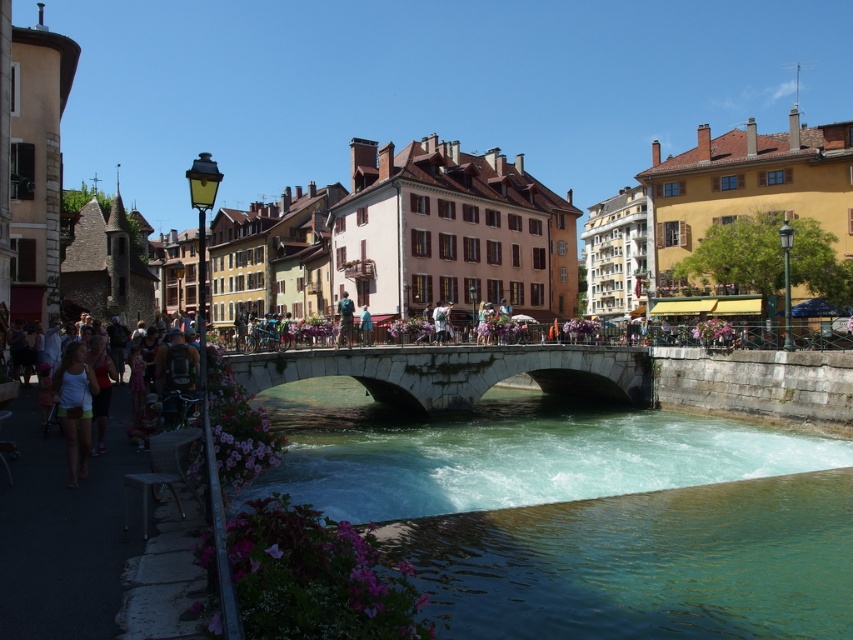
Question: Which object appears closest to the camera in this image?

Choices:
 (A) clear stone water at center
 (B) white cotton shirt at lower left
 (C) smooth stone bridge at center
 (D) blue denim jeans at center

Answer: (A)

Question: Is blue denim jeans at center to the right of blue fabric umbrella at center from the viewer's perspective?

Choices:
 (A) no
 (B) yes

Answer: (A)

Question: Which point appears farthest from the camera in this image?

Choices:
 (A) (582, 588)
 (B) (337, 337)

Answer: (B)

Question: Is stone bridge at center thinner than white fabric shorts at lower left?

Choices:
 (A) no
 (B) yes

Answer: (A)

Question: Estimate the real-world distances between objects in this image. Which object is farther from the stone bridge at center?

Choices:
 (A) white cotton shirt at lower left
 (B) blue fabric umbrella at center
 (C) white fabric shorts at lower left

Answer: (C)

Question: Does clear stone water at center appear on the right side of blue denim jeans at center?

Choices:
 (A) yes
 (B) no

Answer: (A)